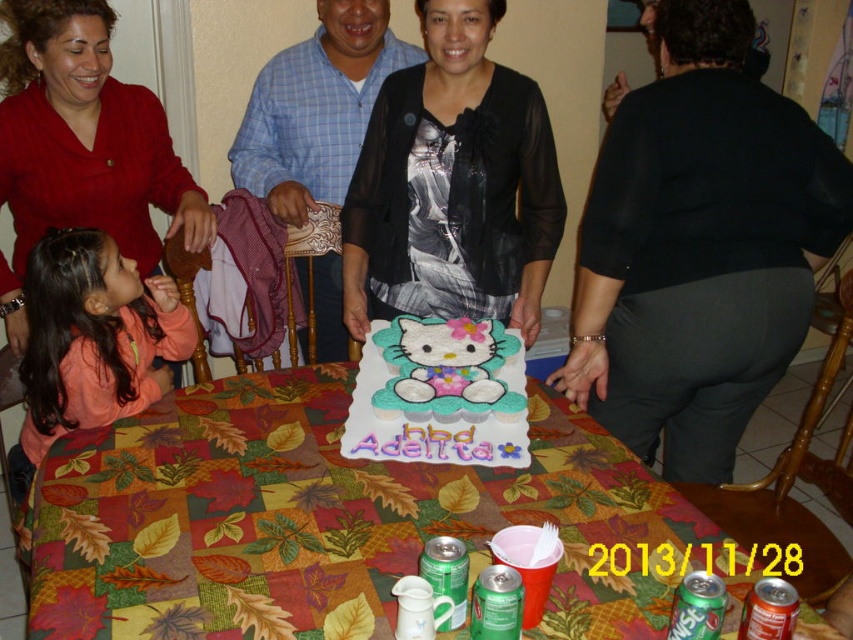
Can you confirm if black fabric at center is thinner than green metallic can at lower center?

In fact, black fabric at center might be wider than green metallic can at lower center.

Is black fabric at center positioned at the back of green metallic can at lower center?

Yes, it is.

Is point (700, 408) closer to viewer compared to point (497, 576)?

No, (700, 408) is behind (497, 576).

The width and height of the screenshot is (853, 640). I want to click on black fabric at center, so click(699, 246).

Which is below, matte white hello kitty cake at center or metallic red soda can at lower right?

Positioned lower is metallic red soda can at lower right.

Between point (386, 452) and point (757, 616), which one is positioned in front?

Point (757, 616) is in front.

The image size is (853, 640). In order to click on matte white hello kitty cake at center in this screenshot , I will do `click(439, 394)`.

Between matte red sweater at upper left and green metallic can at lower center, which one has more height?

matte red sweater at upper left is taller.

Does point (108, 205) come closer to viewer compared to point (508, 637)?

That is False.

In order to click on matte red sweater at upper left in this screenshot , I will do click(82, 144).